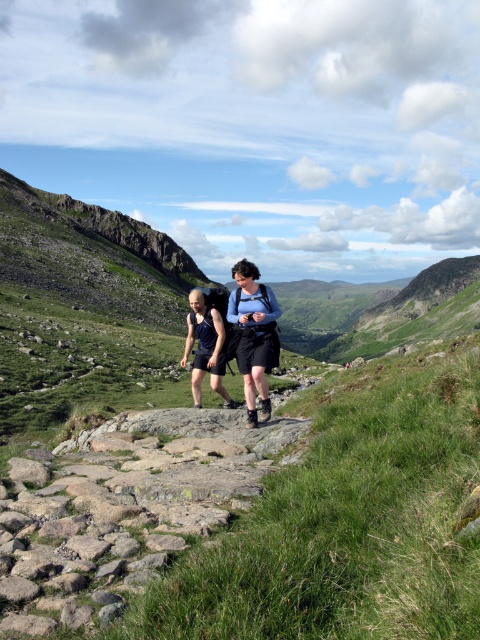
Who is taller, green grassy at center or matte blue backpack at center?

matte blue backpack at center is taller.

Is the position of green grassy at center less distant than that of matte blue backpack at center?

Yes, it is.

Is point (430, 531) positioned before point (266, 348)?

That is True.

Where is `green grassy at center`? This screenshot has height=640, width=480. green grassy at center is located at coordinates (347, 522).

Which of these two, matte blue backpack at center or matte black shorts at center, stands shorter?

With less height is matte black shorts at center.

Can you confirm if matte blue backpack at center is thinner than matte black shorts at center?

Yes, matte blue backpack at center is thinner than matte black shorts at center.

Which is in front, point (236, 294) or point (214, 385)?

Positioned in front is point (214, 385).

I want to click on matte blue backpack at center, so click(x=252, y=336).

From the picture: Between green grassy at center and matte black shorts at center, which one has more height?

matte black shorts at center is taller.

Who is positioned more to the left, green grassy at center or matte black shorts at center?

→ matte black shorts at center

Is point (249, 568) closer to viewer compared to point (204, 316)?

Yes, it is in front of point (204, 316).

Find the location of a particular element. Image resolution: width=480 pixels, height=640 pixels. green grassy at center is located at coordinates (347, 522).